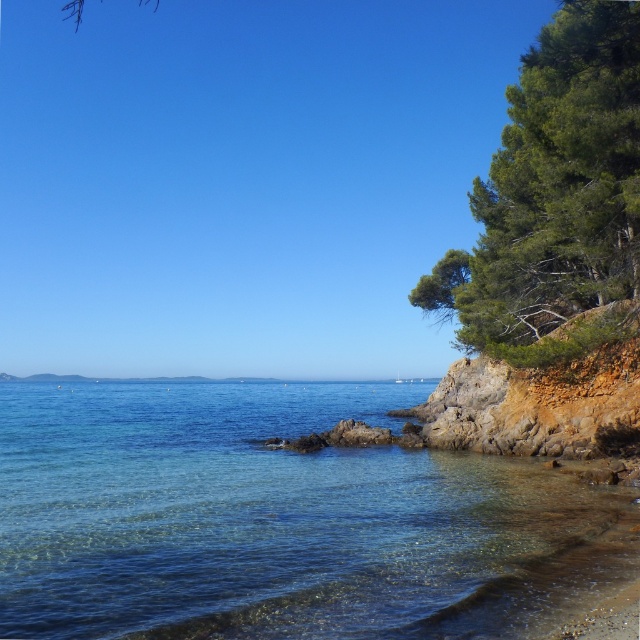
You are a kayaker planning to paddle from the clear water at lower right to the green textured tree at right. Given that your kayak can only handle calm waters up to 100 feet from the shore, will you be able to safely reach the tree?

The clear water at lower right and green textured tree at right are 135.79 feet apart. Since the kayak can only handle calm waters up to 100 feet from the shore, the distance exceeds the safe limit, so you cannot safely reach the tree.

You are standing on the rocky shore and want to reach the clear water at lower right without getting your shoes wet. The green textured tree at right is in your way. Can you walk around the tree to reach the water?

The clear water at lower right is located below the green textured tree at right, so you can walk around the tree to reach the water since it is positioned above the water.